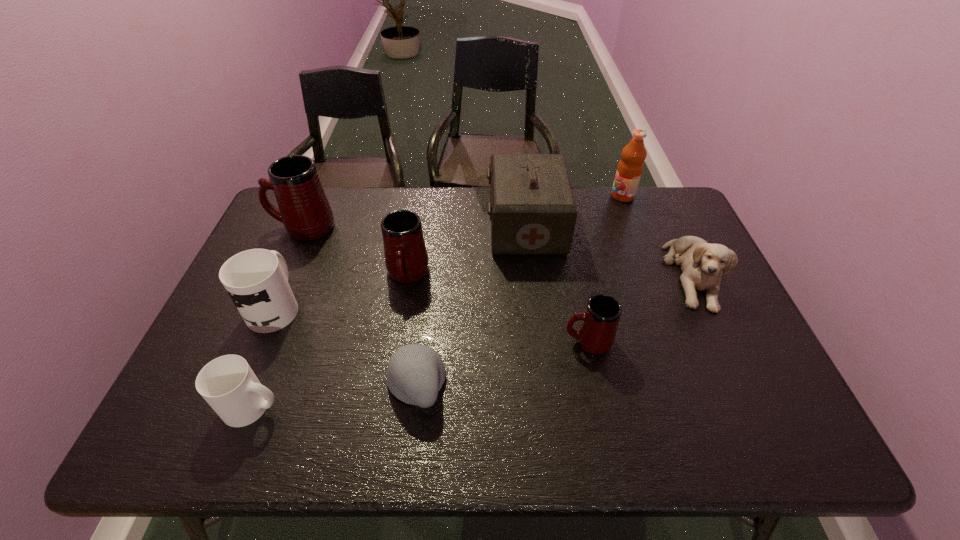
Locate an element on the screen. Image resolution: width=960 pixels, height=540 pixels. the nearest red mug is located at coordinates (596, 333).

The width and height of the screenshot is (960, 540). I want to click on the smaller white mug, so click(228, 384).

I want to click on the nearest mug, so click(228, 384).

Locate an element on the screen. Image resolution: width=960 pixels, height=540 pixels. the shortest object is located at coordinates (415, 374).

Image resolution: width=960 pixels, height=540 pixels. I want to click on gray beanie, so click(x=415, y=374).

Locate an element on the screen. free point located 0.330m on the front label of the fruit juice is located at coordinates (516, 196).

Find the location of a particular element. vacant area located 0.190m on the front label of the fruit juice is located at coordinates (557, 196).

Locate an element on the screen. The width and height of the screenshot is (960, 540). vacant space located on the front label of the fruit juice is located at coordinates (557, 196).

This screenshot has height=540, width=960. Find the location of `vacant region located 0.240m on the right of the first-aid kit`. vacant region located 0.240m on the right of the first-aid kit is located at coordinates (640, 226).

Find the location of a particular element. free spot located 0.150m on the side of the second farthest red mug with the handle is located at coordinates (396, 341).